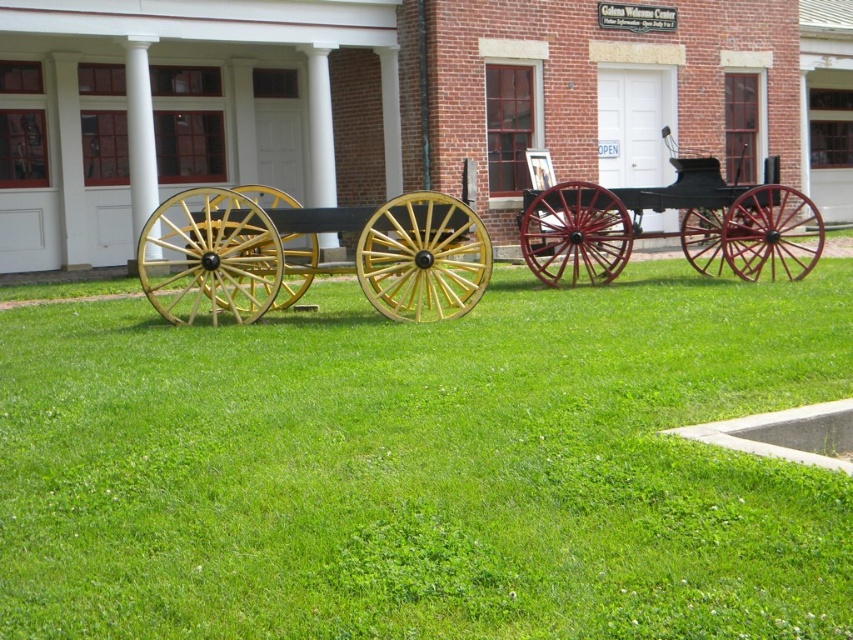
Question: Is green grass at center further to camera compared to wooden wagon wheels at center?

Choices:
 (A) no
 (B) yes

Answer: (A)

Question: Which point is closer to the camera?

Choices:
 (A) green grass at center
 (B) polished wood cart at center
 (C) wooden wagon wheels at center

Answer: (A)

Question: Which of the following is the closest to the observer?

Choices:
 (A) green grass at center
 (B) wooden wagon wheels at center
 (C) polished wood cart at center

Answer: (A)

Question: Is wooden wagon wheels at center positioned at the back of polished wood cart at center?

Choices:
 (A) yes
 (B) no

Answer: (B)

Question: Can you confirm if wooden wagon wheels at center is positioned to the right of polished wood cart at center?

Choices:
 (A) yes
 (B) no

Answer: (B)

Question: Which of the following is the farthest from the observer?

Choices:
 (A) polished wood cart at center
 (B) green grass at center

Answer: (A)